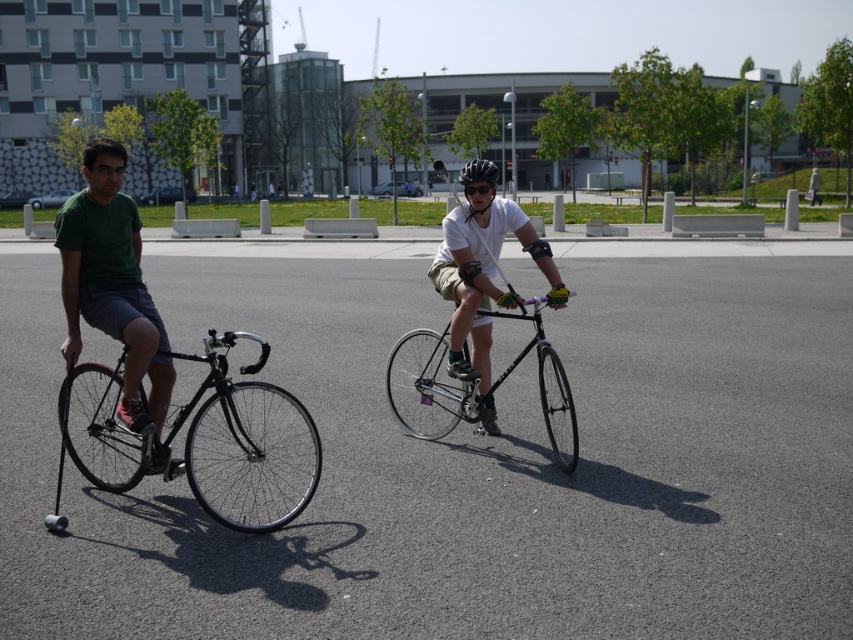
Question: Is the position of matte black bicycle at center more distant than that of shiny black bicycle at center?

Choices:
 (A) no
 (B) yes

Answer: (B)

Question: Which object is positioned farthest from the shiny black bicycle at center?

Choices:
 (A) green matte shirt at left
 (B) shiny black bicycle at left

Answer: (A)

Question: Which object is closer to the camera taking this photo?

Choices:
 (A) black matte helmet at upper center
 (B) matte black bicycle at center

Answer: (B)

Question: Which object appears closest to the camera in this image?

Choices:
 (A) green matte shirt at left
 (B) matte black bicycle at center

Answer: (A)

Question: Can you confirm if green matte shirt at left is bigger than matte black bicycle at center?

Choices:
 (A) yes
 (B) no

Answer: (B)

Question: Does shiny black bicycle at left have a greater width compared to green matte shirt at left?

Choices:
 (A) yes
 (B) no

Answer: (A)